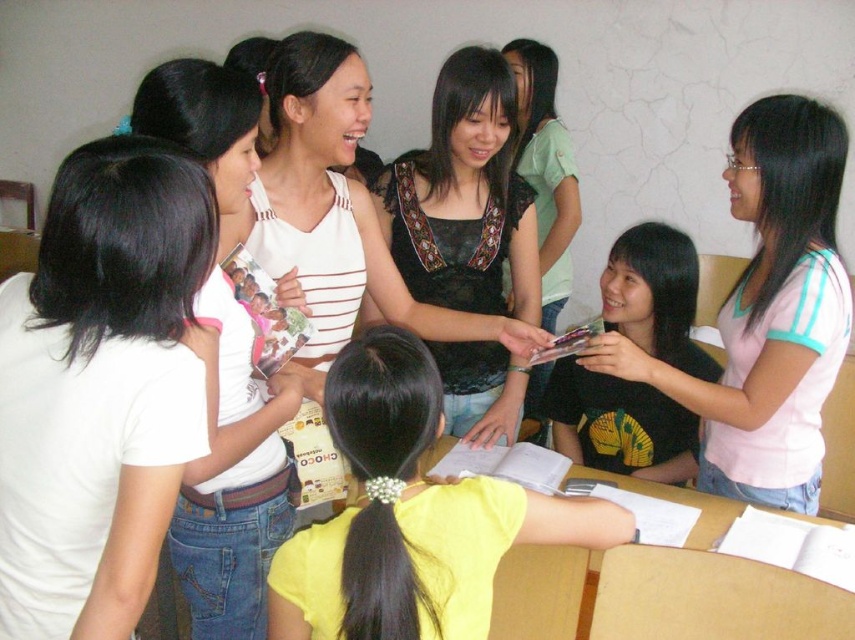
Is point (435, 276) less distant than point (687, 470)?

Yes, it is in front of point (687, 470).

Does point (404, 172) come farther from viewer compared to point (657, 264)?

No.

The image size is (855, 640). Identify the location of black lace top at center. (464, 196).

Between point (171, 262) and point (714, 449), which one is positioned in front?

Point (171, 262) is in front.

Does point (172, 259) lie behind point (781, 429)?

That is False.

Is point (75, 284) more distant than point (811, 230)?

No, it is not.

Locate an element on the screen. white matte shirt at upper left is located at coordinates (99, 388).

Is white matte shirt at upper left positioned in front of white striped tank top at upper left?

Yes, white matte shirt at upper left is in front of white striped tank top at upper left.

Between white matte shirt at upper left and white striped tank top at upper left, which one has more height?

white striped tank top at upper left is taller.

Is point (71, 634) farther from viewer compared to point (236, 113)?

No, (71, 634) is in front of (236, 113).

In order to click on white matte shirt at upper left in this screenshot , I will do `click(99, 388)`.